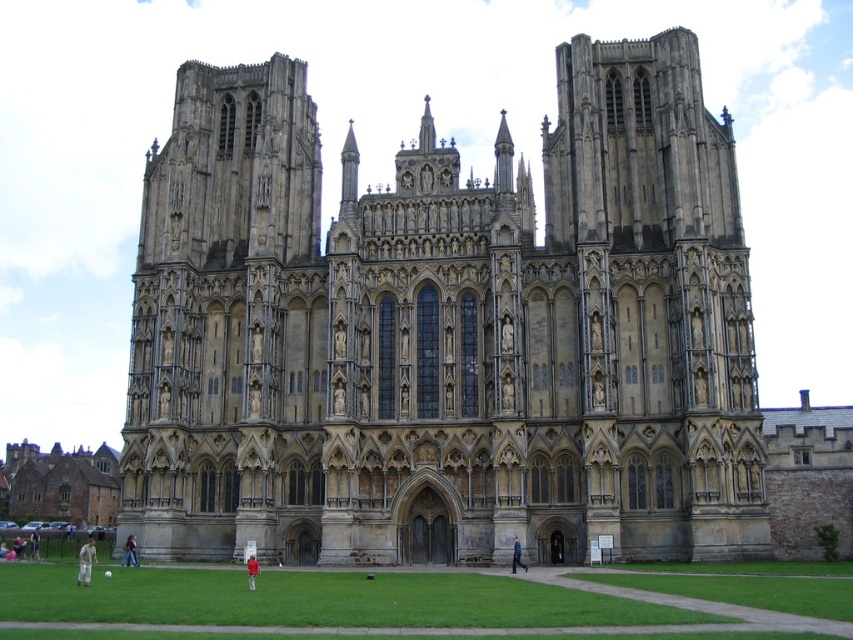
You are standing in front of the Wells Cathedral and notice two churches in the image. According to the scene, which direction is the stone church at center relative to the brown stone church at lower left?

The stone church at center is to the right of the brown stone church at lower left.

You are standing in front of the Wells Cathedral scene and want to take a photo that includes both the stone church at center and the brown stone church at lower left. Which church should you position closer to the camera to ensure both are fully visible in the frame?

To ensure both the stone church at center and the brown stone church at lower left are fully visible in the frame, position the brown stone church at lower left closer to the camera since it is shorter than the taller stone church at center.

You are standing in front of the Wells Cathedral and notice two churches in the image. Which one is positioned higher up, the stone church at center or the brown stone church at lower left?

The stone church at center is located above the brown stone church at lower left, so it is positioned higher up.